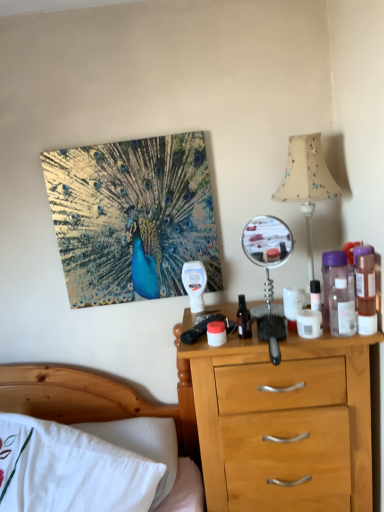
Measure the distance between point (185, 438) and camera.

Point (185, 438) is 5.30 feet away from camera.

In order to click on black plastic remote control at center in this screenshot , I will do `click(200, 329)`.

Which of these two, black plastic remote control at center or translucent plastic bottle at right, the 1th bottle when ordered from right to left, is wider?

Wider between the two is black plastic remote control at center.

Is black plastic remote control at center not inside translucent plastic bottle at right, which is the 4th bottle in left-to-right order?

black plastic remote control at center lies outside translucent plastic bottle at right, which is the 4th bottle in left-to-right order,'s area.

From the picture: Who is smaller, black plastic remote control at center or translucent plastic bottle at right, the 1th bottle when ordered from right to left?

black plastic remote control at center is smaller.

In the scene shown: Is black plastic remote control at center oriented towards translucent plastic bottle at right, which is the 4th bottle in left-to-right order?

No, black plastic remote control at center is not aimed at translucent plastic bottle at right, which is the 4th bottle in left-to-right order.

From the picture: Does transparent glass bottle at center, the 1th bottle viewed from the left, turn towards transparent plastic bottle at right, which is the third bottle from left to right?

No.

Can you confirm if transparent glass bottle at center, the fourth bottle positioned from the right, is positioned to the left of transparent plastic bottle at right, acting as the 2th bottle starting from the right?

Yes.

From the image's perspective, is transparent glass bottle at center, the fourth bottle positioned from the right, above or below transparent plastic bottle at right, which is the third bottle from left to right?

transparent glass bottle at center, the fourth bottle positioned from the right, is situated lower than transparent plastic bottle at right, which is the third bottle from left to right, in the image.

Is transparent glass bottle at center, the 1th bottle viewed from the left, outside of transparent plastic bottle at right, which is the third bottle from left to right?

Yes, transparent glass bottle at center, the 1th bottle viewed from the left, is outside of transparent plastic bottle at right, which is the third bottle from left to right.

There is a translucent plastic bottle at right, which is the 4th bottle in left-to-right order. Where is `mirror above it (from a real-world perspective)`? mirror above it (from a real-world perspective) is located at coordinates (267, 254).

Is metallic silver mirror at upper right to the right of translucent plastic bottle at right, which is the 4th bottle in left-to-right order, from the viewer's perspective?

No.

From the image's perspective, which one is positioned higher, metallic silver mirror at upper right or translucent plastic bottle at right, the 1th bottle when ordered from right to left?

metallic silver mirror at upper right appears higher in the image.

In terms of width, does metallic silver mirror at upper right look wider or thinner when compared to translucent plastic bottle at right, which is the 4th bottle in left-to-right order?

In the image, metallic silver mirror at upper right appears to be wider than translucent plastic bottle at right, which is the 4th bottle in left-to-right order.

In order to click on the 4th bottle above when counting from the black plastic remote control at center (from the image's perspective) in this screenshot , I will do coord(332,277).

Is purple translucent bottle at right, the 3th bottle from the right, in front of or behind black plastic remote control at center in the image?

purple translucent bottle at right, the 3th bottle from the right, is positioned closer to the viewer than black plastic remote control at center.

Which object is positioned more to the left, purple translucent bottle at right, which ranks as the second bottle in left-to-right order, or black plastic remote control at center?

black plastic remote control at center is more to the left.

Does purple translucent bottle at right, which ranks as the second bottle in left-to-right order, turn towards black plastic remote control at center?

No, purple translucent bottle at right, which ranks as the second bottle in left-to-right order, does not turn towards black plastic remote control at center.

Is translucent plastic bottle at right, which is the 4th bottle in left-to-right order, not inside shiny metallic peacock at upper left?

Yes, translucent plastic bottle at right, which is the 4th bottle in left-to-right order, is not within shiny metallic peacock at upper left.

Is translucent plastic bottle at right, the 1th bottle when ordered from right to left, taller than shiny metallic peacock at upper left?

No.

Is translucent plastic bottle at right, which is the 4th bottle in left-to-right order, next to shiny metallic peacock at upper left?

No, translucent plastic bottle at right, which is the 4th bottle in left-to-right order, is not in contact with shiny metallic peacock at upper left.

Which is more to the left, translucent plastic bottle at right, the 1th bottle when ordered from right to left, or shiny metallic peacock at upper left?

shiny metallic peacock at upper left.

Considering the relative positions of transparent glass bottle at center, the fourth bottle positioned from the right, and beige fabric lampshade at upper right in the image provided, is transparent glass bottle at center, the fourth bottle positioned from the right, to the right of beige fabric lampshade at upper right from the viewer's perspective?

Incorrect, transparent glass bottle at center, the fourth bottle positioned from the right, is not on the right side of beige fabric lampshade at upper right.

Considering their positions, is transparent glass bottle at center, the fourth bottle positioned from the right, located in front of or behind beige fabric lampshade at upper right?

Clearly, transparent glass bottle at center, the fourth bottle positioned from the right, is in front of beige fabric lampshade at upper right.

Is transparent glass bottle at center, the fourth bottle positioned from the right, shorter than beige fabric lampshade at upper right?

Yes, transparent glass bottle at center, the fourth bottle positioned from the right, is shorter than beige fabric lampshade at upper right.

From a real-world perspective, relative to beige fabric lampshade at upper right, is transparent glass bottle at center, the fourth bottle positioned from the right, vertically above or below?

Clearly, from a real-world perspective, transparent glass bottle at center, the fourth bottle positioned from the right, is below beige fabric lampshade at upper right.

From a real-world perspective, who is located higher, purple translucent bottle at right, which ranks as the second bottle in left-to-right order, or translucent plastic bottle at right, the 1th bottle when ordered from right to left?

purple translucent bottle at right, which ranks as the second bottle in left-to-right order.

Could you tell me if purple translucent bottle at right, the 3th bottle from the right, is facing translucent plastic bottle at right, which is the 4th bottle in left-to-right order?

No.

From the image's perspective, is purple translucent bottle at right, the 3th bottle from the right, located above or below translucent plastic bottle at right, which is the 4th bottle in left-to-right order?

purple translucent bottle at right, the 3th bottle from the right, is situated higher than translucent plastic bottle at right, which is the 4th bottle in left-to-right order, in the image.

Are purple translucent bottle at right, the 3th bottle from the right, and translucent plastic bottle at right, the 1th bottle when ordered from right to left, located far from each other?

purple translucent bottle at right, the 3th bottle from the right, is actually quite close to translucent plastic bottle at right, the 1th bottle when ordered from right to left.

From the image's perspective, which bottle is the 3rd one above the black plastic remote control at center? Please provide its 2D coordinates.

[(365, 289)]

This screenshot has height=512, width=384. Find the location of `bottle that is the 2nd one when counting leftward from the transparent plastic bottle at right, which is the third bottle from left to right`. bottle that is the 2nd one when counting leftward from the transparent plastic bottle at right, which is the third bottle from left to right is located at coordinates (243, 319).

Considering their positions, is transparent plastic bottle at right, which is the third bottle from left to right, positioned further to metallic silver mirror at upper right than black plastic remote control at center?

The object further to metallic silver mirror at upper right is transparent plastic bottle at right, which is the third bottle from left to right.

Estimate the real-world distances between objects in this image. Which object is further from white matte jar at center, metallic silver mirror at upper right or transparent glass bottle at center, the fourth bottle positioned from the right?

metallic silver mirror at upper right lies further to white matte jar at center than the other object.

When comparing their distances from transparent plastic bottle at right, which is the third bottle from left to right, does black plastic remote control at center or metallic silver mirror at upper right seem further?

The object further to transparent plastic bottle at right, which is the third bottle from left to right, is black plastic remote control at center.

Considering their positions, is metallic silver mirror at upper right positioned closer to transparent glass bottle at center, the fourth bottle positioned from the right, than shiny metallic peacock at upper left?

metallic silver mirror at upper right.

Based on the photo, when comparing their distances from transparent plastic bottle at right, acting as the 2th bottle starting from the right, does shiny metallic peacock at upper left or black plastic remote control at center seem further?

shiny metallic peacock at upper left is further to transparent plastic bottle at right, acting as the 2th bottle starting from the right.

Which object lies further to the anchor point metallic silver mirror at upper right, shiny metallic peacock at upper left or white matte jar at center?

shiny metallic peacock at upper left lies further to metallic silver mirror at upper right than the other object.

When comparing their distances from translucent plastic bottle at right, which is the 4th bottle in left-to-right order, does purple translucent bottle at right, which ranks as the second bottle in left-to-right order, or beige fabric lampshade at upper right seem further?

Based on the image, beige fabric lampshade at upper right appears to be further to translucent plastic bottle at right, which is the 4th bottle in left-to-right order.

Considering their positions, is black plastic remote control at center positioned closer to transparent glass bottle at center, the fourth bottle positioned from the right, than transparent plastic bottle at right, which is the third bottle from left to right?

Based on the image, black plastic remote control at center appears to be nearer to transparent glass bottle at center, the fourth bottle positioned from the right.

Locate an element on the screen. This screenshot has height=512, width=384. remote control between shiny metallic peacock at upper left and white matte jar at center in the horizontal direction is located at coordinates (200, 329).

Identify the location of bottle between white cotton bed at lower left and white matte jar at center in the horizontal direction. This screenshot has width=384, height=512. (243, 319).

This screenshot has height=512, width=384. What are the coordinates of `table lamp situated between shiny metallic peacock at upper left and transparent plastic bottle at right, acting as the 2th bottle starting from the right, from left to right` in the screenshot? It's located at (307, 182).

You are a GUI agent. You are given a task and a screenshot of the screen. Output one action in this format:
    pyautogui.click(x=<x>, y=<y>)
    Task: Click on the mirror between shiny metallic peacock at upper left and white matte jar at center from left to right
    This screenshot has height=512, width=384.
    Given the screenshot: What is the action you would take?
    pyautogui.click(x=267, y=254)